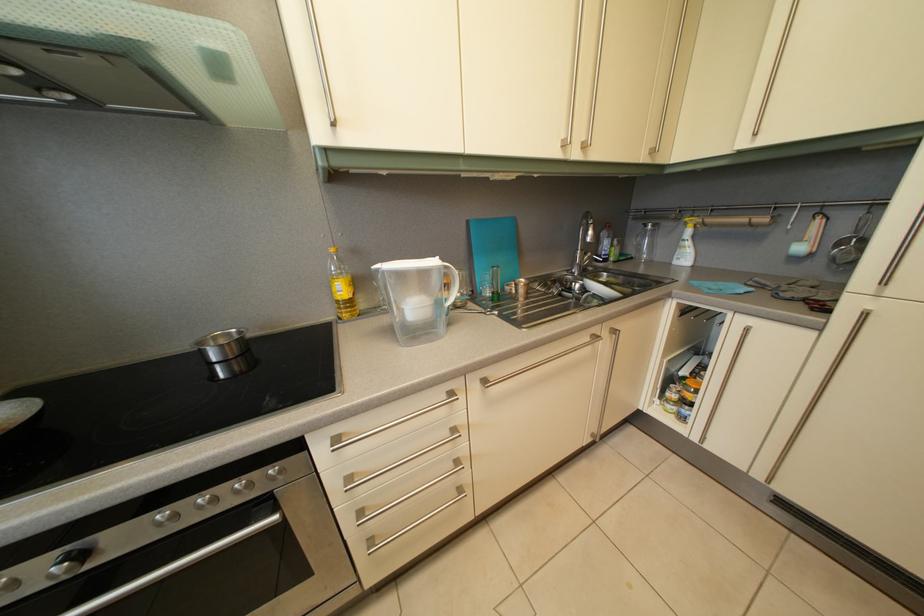
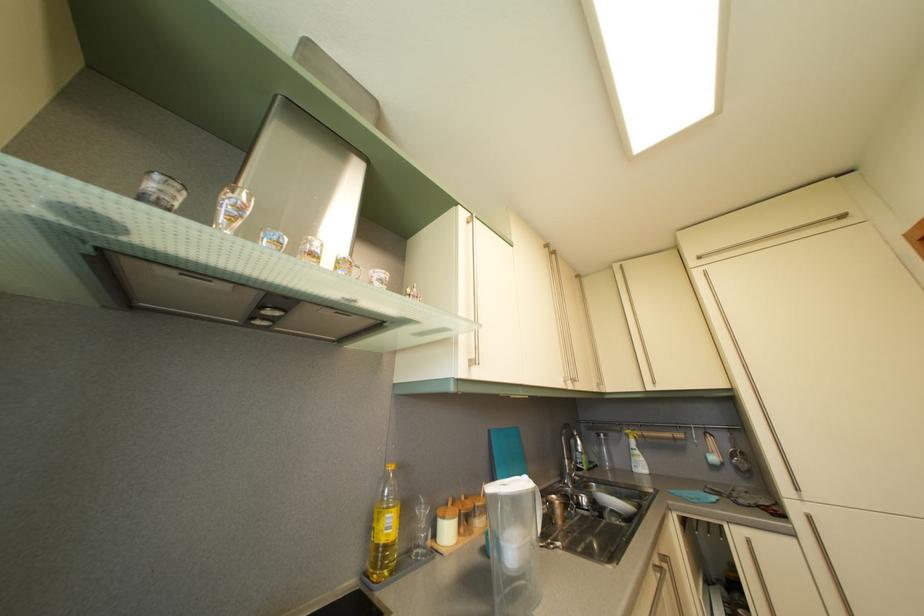
The point at (597, 300) is marked in the first image. Where is the corresponding point in the second image?

(613, 516)